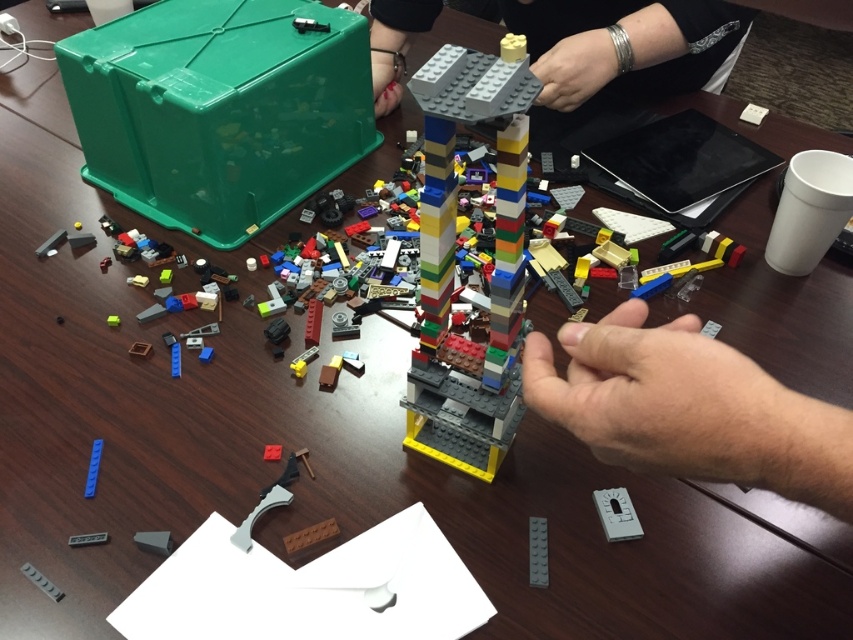
Question: Does smooth gray hand at center have a greater width compared to multicolored plastic tower at center?

Choices:
 (A) yes
 (B) no

Answer: (A)

Question: Among these objects, which one is nearest to the camera?

Choices:
 (A) smooth gray lego piece at upper center
 (B) multicolored plastic tower at center
 (C) smooth gray hand at center

Answer: (C)

Question: Which point is closer to the camera taking this photo?

Choices:
 (A) (640, 33)
 (B) (521, 266)
 (C) (751, 465)

Answer: (C)

Question: Among these points, which one is farthest from the camera?

Choices:
 (A) (540, 122)
 (B) (466, 116)
 (C) (659, 408)

Answer: (A)

Question: Is smooth gray hand at center below multicolored plastic tower at center?

Choices:
 (A) yes
 (B) no

Answer: (A)

Question: Observing the image, what is the correct spatial positioning of multicolored plastic tower at center in reference to smooth gray lego piece at upper center?

Choices:
 (A) below
 (B) above

Answer: (A)